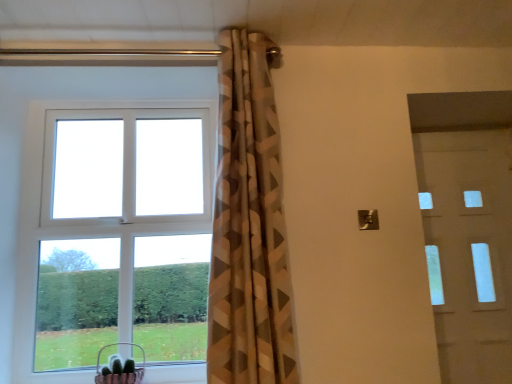
Question: Does metallic pink basket at lower left turn towards white plastic window at upper left?

Choices:
 (A) yes
 (B) no

Answer: (B)

Question: Are metallic pink basket at lower left and white plastic window at upper left beside each other?

Choices:
 (A) no
 (B) yes

Answer: (A)

Question: Is metallic pink basket at lower left further to the viewer compared to white plastic window at upper left?

Choices:
 (A) no
 (B) yes

Answer: (A)

Question: Would you say metallic pink basket at lower left contains white plastic window at upper left?

Choices:
 (A) no
 (B) yes

Answer: (A)

Question: From a real-world perspective, is metallic pink basket at lower left positioned under white plastic window at upper left based on gravity?

Choices:
 (A) no
 (B) yes

Answer: (B)

Question: Considering their positions, is metallic pink basket at lower left located in front of or behind white glossy door at right?

Choices:
 (A) behind
 (B) front

Answer: (B)

Question: In terms of width, does metallic pink basket at lower left look wider or thinner when compared to white glossy door at right?

Choices:
 (A) thin
 (B) wide

Answer: (B)

Question: In terms of height, does metallic pink basket at lower left look taller or shorter compared to white glossy door at right?

Choices:
 (A) short
 (B) tall

Answer: (A)

Question: From the image's perspective, is metallic pink basket at lower left above or below white glossy door at right?

Choices:
 (A) above
 (B) below

Answer: (B)

Question: Considering the positions of white plastic window at upper left and white glossy door at right in the image, is white plastic window at upper left wider or thinner than white glossy door at right?

Choices:
 (A) wide
 (B) thin

Answer: (A)

Question: From their relative heights in the image, would you say white plastic window at upper left is taller or shorter than white glossy door at right?

Choices:
 (A) short
 (B) tall

Answer: (A)

Question: From the image's perspective, relative to white glossy door at right, is white plastic window at upper left above or below?

Choices:
 (A) above
 (B) below

Answer: (A)

Question: In terms of size, does white plastic window at upper left appear bigger or smaller than white glossy door at right?

Choices:
 (A) small
 (B) big

Answer: (B)

Question: Considering the positions of white glossy door at right and geometric-patterned curtain at center in the image, is white glossy door at right bigger or smaller than geometric-patterned curtain at center?

Choices:
 (A) big
 (B) small

Answer: (B)

Question: Is point (435, 168) positioned closer to the camera than point (266, 306)?

Choices:
 (A) closer
 (B) farther

Answer: (B)